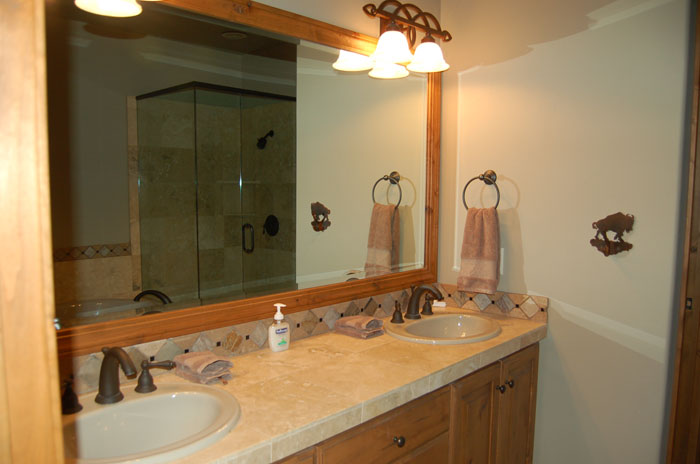
At what (x,y) coordinates should I click in order to perform the action: click on wooden mirror frame. Please return your answer as a coordinate pair (x, y). This screenshot has width=700, height=464. Looking at the image, I should click on (222, 313).